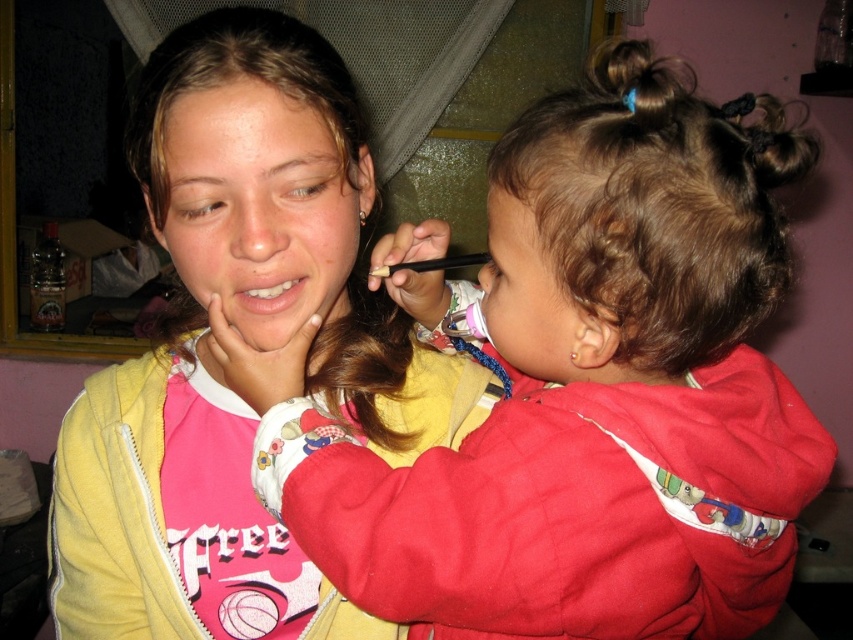
Is point (675, 627) farther from camera compared to point (252, 289)?

No, (675, 627) is in front of (252, 289).

Measure the distance between point [613,502] and camera.

Point [613,502] is 17.01 inches from camera.

Locate an element on the screen. This screenshot has height=640, width=853. soft pink hoodie at center is located at coordinates (593, 392).

Does yellow fleece jacket at upper left appear on the right side of brown hair at upper left?

Indeed, yellow fleece jacket at upper left is positioned on the right side of brown hair at upper left.

Describe the element at coordinates (247, 340) in the screenshot. I see `yellow fleece jacket at upper left` at that location.

Is point (328, 61) behind point (215, 179)?

That is True.

This screenshot has width=853, height=640. In order to click on yellow fleece jacket at upper left in this screenshot , I will do `click(247, 340)`.

Which is in front, point (505, 333) or point (178, 241)?

Point (505, 333)

Identify the location of soft pink hoodie at center. (593, 392).